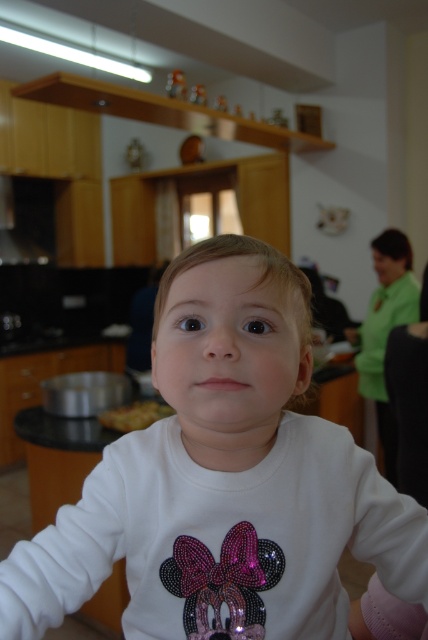
You are a photographer adjusting your camera to focus on two points in the image. The first point is at coordinates point (172, 394) and the second is at point (119, 419). Which point should you focus on first if you want to ensure the closest object is in focus?

Point (172, 394) is closer to the camera than point (119, 419), so you should focus on point (172, 394) first to ensure the closest object is in focus.

You are a photographer setting up a shoot in the kitchen. You notice the white matte shirt at center and the yellowish matte food at lower left. Which object should you focus on if you want to capture the subject in the foreground?

The white matte shirt at center should be focused on because it is in front of the yellowish matte food at lower left, making it the foreground subject.